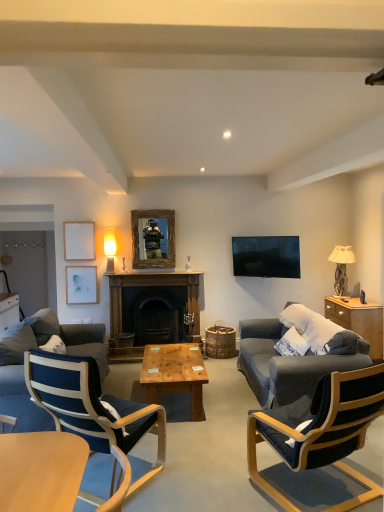
This screenshot has height=512, width=384. Identify the location of matte white picture frame at upper left, the first picture frame when ordered from bottom to top. (81, 284).

This screenshot has width=384, height=512. Describe the element at coordinates (110, 249) in the screenshot. I see `matte gold lampshade at upper left, which is counted as the second lamp, starting from the right` at that location.

This screenshot has width=384, height=512. Describe the element at coordinates (21, 401) in the screenshot. I see `dark gray fabric couch at left` at that location.

The image size is (384, 512). Describe the element at coordinates (321, 430) in the screenshot. I see `dark blue fabric chair at right, which is the first chair in right-to-left order` at that location.

Image resolution: width=384 pixels, height=512 pixels. Identify the location of matte white picture frame at upper left, the first picture frame when ordered from bottom to top. (81, 284).

Considering the positions of objects matte gold lampshade at upper left, the 1th lamp viewed from the left, and dark blue fabric chair at right, which is the first chair in right-to-left order, in the image provided, who is behind, matte gold lampshade at upper left, the 1th lamp viewed from the left, or dark blue fabric chair at right, which is the first chair in right-to-left order,?

matte gold lampshade at upper left, the 1th lamp viewed from the left, is further away from the camera.

Is matte gold lampshade at upper left, which is counted as the second lamp, starting from the right, turned away from dark blue fabric chair at right, the 2th chair positioned from the left?

No, dark blue fabric chair at right, the 2th chair positioned from the left, is not at the back of matte gold lampshade at upper left, which is counted as the second lamp, starting from the right.

From a real-world perspective, who is located lower, matte gold lampshade at upper left, which is counted as the second lamp, starting from the right, or dark blue fabric chair at right, which is the first chair in right-to-left order?

dark blue fabric chair at right, which is the first chair in right-to-left order, is physically lower.

The width and height of the screenshot is (384, 512). In order to click on lamp that is the 1st one when counting backward from the wooden cabinet at right, the first cabinetry from the right in this screenshot , I will do `click(341, 267)`.

From the picture: Is beige fabric lampshade at right, acting as the first lamp starting from the right, positioned before wooden cabinet at right, the second cabinetry viewed from the left?

No, the depth of beige fabric lampshade at right, acting as the first lamp starting from the right, is greater than that of wooden cabinet at right, the second cabinetry viewed from the left.

From the image's perspective, which one is positioned higher, beige fabric lampshade at right, which ranks as the 2th lamp in left-to-right order, or wooden cabinet at right, the second cabinetry viewed from the left?

beige fabric lampshade at right, which ranks as the 2th lamp in left-to-right order, is shown above in the image.

Which of these two, beige fabric lampshade at right, acting as the first lamp starting from the right, or wooden cabinet at right, the 1th cabinetry in the front-to-back sequence, stands shorter?

Standing shorter between the two is wooden cabinet at right, the 1th cabinetry in the front-to-back sequence.

Which of these two, wooden frame mirror at center or matte white picture frame at upper left, the first picture frame when ordered from bottom to top, is smaller?

matte white picture frame at upper left, the first picture frame when ordered from bottom to top.

Considering the sizes of objects wooden frame mirror at center and matte white picture frame at upper left, the first picture frame when ordered from bottom to top, in the image provided, who is taller, wooden frame mirror at center or matte white picture frame at upper left, the first picture frame when ordered from bottom to top,?

Standing taller between the two is wooden frame mirror at center.

In the scene shown: Is wooden frame mirror at center thinner than matte white picture frame at upper left, which is the 2th picture frame from top to bottom?

Incorrect, the width of wooden frame mirror at center is not less than that of matte white picture frame at upper left, which is the 2th picture frame from top to bottom.

Does point (152, 241) appear closer or farther from the camera than point (73, 276)?

Clearly, point (152, 241) is closer to the camera than point (73, 276).

Would you say light brown wooden coffee table at center, arranged as the second coffee table when viewed from the front, is inside or outside dark gray fabric couch at left?

light brown wooden coffee table at center, arranged as the second coffee table when viewed from the front, exists outside the volume of dark gray fabric couch at left.

Is light brown wooden coffee table at center, arranged as the second coffee table when viewed from the front, not near dark gray fabric couch at left?

No, light brown wooden coffee table at center, arranged as the second coffee table when viewed from the front, is in close proximity to dark gray fabric couch at left.

This screenshot has width=384, height=512. What are the coordinates of `studio couch above the light brown wooden coffee table at center, acting as the first coffee table starting from the back (from the image's perspective)` in the screenshot? It's located at (21, 401).

Which object is positioned more to the left, light brown wooden coffee table at center, arranged as the second coffee table when viewed from the front, or dark gray fabric couch at left?

dark gray fabric couch at left.

Considering the sizes of objects wooden frame mirror at center and white glossy cabinet at left, positioned as the 2th cabinetry in right-to-left order, in the image provided, who is shorter, wooden frame mirror at center or white glossy cabinet at left, positioned as the 2th cabinetry in right-to-left order,?

Standing shorter between the two is wooden frame mirror at center.

Consider the image. Who is smaller, wooden frame mirror at center or white glossy cabinet at left, which is the second cabinetry in front-to-back order?

Smaller between the two is wooden frame mirror at center.

At what (x,y) coordinates should I click in order to perform the action: click on the 2nd cabinetry below when counting from the wooden frame mirror at center (from the image's perspective). Please return your answer as a coordinate pair (x, y). Looking at the image, I should click on (8, 310).

From a real-world perspective, does wooden frame mirror at center stand above white glossy cabinet at left, which is the second cabinetry in front-to-back order?

Yes, from a real-world perspective, wooden frame mirror at center is above white glossy cabinet at left, which is the second cabinetry in front-to-back order.

In the scene shown: Does light brown wooden coffee table at lower left, placed as the first coffee table when sorted from front to back, appear on the right side of beige fabric lampshade at right, acting as the first lamp starting from the right?

No, light brown wooden coffee table at lower left, placed as the first coffee table when sorted from front to back, is not to the right of beige fabric lampshade at right, acting as the first lamp starting from the right.

Between light brown wooden coffee table at lower left, placed as the first coffee table when sorted from front to back, and beige fabric lampshade at right, acting as the first lamp starting from the right, which one has less height?

light brown wooden coffee table at lower left, placed as the first coffee table when sorted from front to back.

From the image's perspective, is light brown wooden coffee table at lower left, positioned as the second coffee table in back-to-front order, positioned above or below beige fabric lampshade at right, acting as the first lamp starting from the right?

From the image's perspective, light brown wooden coffee table at lower left, positioned as the second coffee table in back-to-front order, appears below beige fabric lampshade at right, acting as the first lamp starting from the right.

Is point (66, 451) closer to viewer compared to point (335, 272)?

Yes, it is in front of point (335, 272).

Which is more to the right, white glossy cabinet at left, which is the second cabinetry in front-to-back order, or matte gold lampshade at upper left, which is counted as the second lamp, starting from the right?

Positioned to the right is matte gold lampshade at upper left, which is counted as the second lamp, starting from the right.

In the scene shown: Is white glossy cabinet at left, which is counted as the first cabinetry, starting from the back, placed right next to matte gold lampshade at upper left, the 1th lamp viewed from the left?

A: There is a gap between white glossy cabinet at left, which is counted as the first cabinetry, starting from the back, and matte gold lampshade at upper left, the 1th lamp viewed from the left.

From a real-world perspective, which is physically below, white glossy cabinet at left, which appears as the 1th cabinetry when viewed from the left, or matte gold lampshade at upper left, the 1th lamp viewed from the left?

From a 3D spatial view, white glossy cabinet at left, which appears as the 1th cabinetry when viewed from the left, is below.

Is white glossy cabinet at left, positioned as the 2th cabinetry in right-to-left order, taller or shorter than matte gold lampshade at upper left, the 1th lamp viewed from the left?

In the image, white glossy cabinet at left, positioned as the 2th cabinetry in right-to-left order, appears to be taller than matte gold lampshade at upper left, the 1th lamp viewed from the left.

From the image's perspective, starting from the matte gold lampshade at upper left, the 1th lamp viewed from the left, which chair is the 1st one below? Please provide its 2D coordinates.

[(321, 430)]

I want to click on lamp that is the 1st one when counting backward from the wooden cabinet at right, the 1th cabinetry in the front-to-back sequence, so click(341, 267).

Which object lies further to the anchor point white glossy cabinet at left, which is the second cabinetry in front-to-back order, wooden frame mirror at center or matte white picture frame at upper left, the first picture frame when ordered from bottom to top?

wooden frame mirror at center is positioned further to the anchor white glossy cabinet at left, which is the second cabinetry in front-to-back order.

Which object lies nearer to the anchor point white glossy cabinet at left, positioned as the 2th cabinetry in right-to-left order, dark blue fabric chair at right, which is the first chair in right-to-left order, or wooden cabinet at right, the first cabinetry from the right?

dark blue fabric chair at right, which is the first chair in right-to-left order, is positioned closer to the anchor white glossy cabinet at left, positioned as the 2th cabinetry in right-to-left order.

Considering their positions, is dark gray fabric couch at left positioned closer to wooden frame mirror at center than wooden picture frame at upper left, which is the 2th picture frame in bottom-to-top order?

The object closer to wooden frame mirror at center is wooden picture frame at upper left, which is the 2th picture frame in bottom-to-top order.

Consider the image. Which object lies further to the anchor point dark blue fabric chair at right, which is the first chair in right-to-left order, beige fabric lampshade at right, which ranks as the 2th lamp in left-to-right order, or matte white picture frame at upper left, which is the 2th picture frame from top to bottom?

Among the two, matte white picture frame at upper left, which is the 2th picture frame from top to bottom, is located further to dark blue fabric chair at right, which is the first chair in right-to-left order.

From the image, which object appears to be nearer to dark blue fabric chair at right, the 2th chair positioned from the left, light brown wooden coffee table at lower left, placed as the first coffee table when sorted from front to back, or wooden cabinet at right, the second cabinetry viewed from the left?

wooden cabinet at right, the second cabinetry viewed from the left.

Looking at this image, considering their positions, is white glossy cabinet at left, which appears as the 1th cabinetry when viewed from the left, positioned further to light brown wooden coffee table at lower left, positioned as the second coffee table in back-to-front order, than dark blue fabric chair at right, the 2th chair positioned from the left?

white glossy cabinet at left, which appears as the 1th cabinetry when viewed from the left, is further to light brown wooden coffee table at lower left, positioned as the second coffee table in back-to-front order.

Considering their positions, is light brown wooden coffee table at lower left, positioned as the second coffee table in back-to-front order, positioned further to wooden picture frame at upper left, arranged as the first picture frame when viewed from the top, than white glossy cabinet at left, which is the second cabinetry in front-to-back order?

Among the two, light brown wooden coffee table at lower left, positioned as the second coffee table in back-to-front order, is located further to wooden picture frame at upper left, arranged as the first picture frame when viewed from the top.

When comparing their distances from dark blue fabric chair at right, the 2th chair positioned from the left, does light brown wooden coffee table at center, arranged as the second coffee table when viewed from the front, or blue fabric chair at lower left, the 1th chair from the left, seem further?

light brown wooden coffee table at center, arranged as the second coffee table when viewed from the front, is further to dark blue fabric chair at right, the 2th chair positioned from the left.

This screenshot has width=384, height=512. Find the location of `mirror between dark gray fabric couch at left and matte white picture frame at upper left, the first picture frame when ordered from bottom to top, from front to back`. mirror between dark gray fabric couch at left and matte white picture frame at upper left, the first picture frame when ordered from bottom to top, from front to back is located at coordinates (153, 239).

At what (x,y) coordinates should I click in order to perform the action: click on coffee table positioned between dark blue fabric chair at right, the 2th chair positioned from the left, and dark wood fireplace at center from near to far. Please return your answer as a coordinate pair (x, y). Looking at the image, I should click on (175, 373).

The image size is (384, 512). I want to click on mirror between light brown wooden coffee table at center, acting as the first coffee table starting from the back, and matte white picture frame at upper left, which is the 2th picture frame from top to bottom, in the front-back direction, so click(153, 239).

Find the location of `coffee table located between light brown wooden coffee table at lower left, positioned as the second coffee table in back-to-front order, and white glossy cabinet at left, which appears as the 1th cabinetry when viewed from the left, in the depth direction`. coffee table located between light brown wooden coffee table at lower left, positioned as the second coffee table in back-to-front order, and white glossy cabinet at left, which appears as the 1th cabinetry when viewed from the left, in the depth direction is located at coordinates (175, 373).